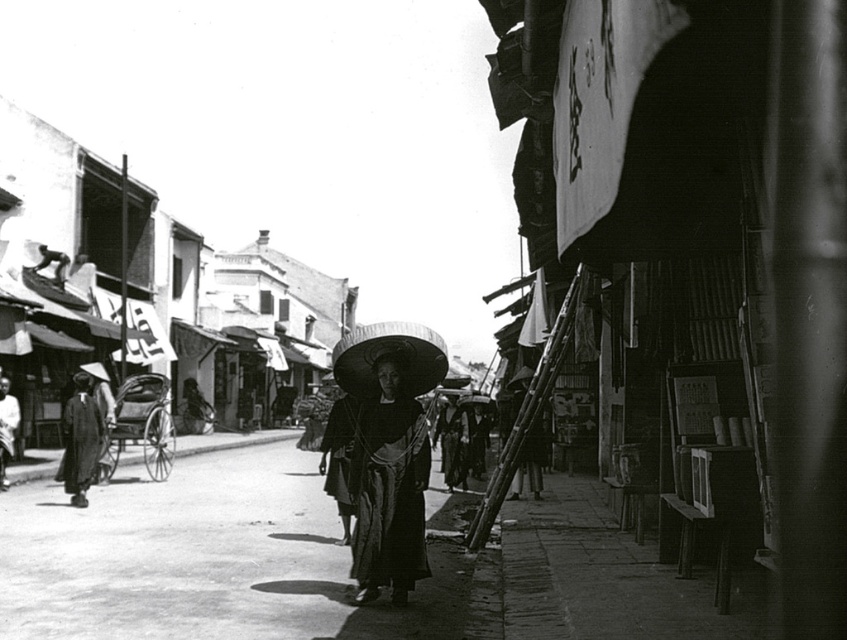
Based on the scene description, where is the matte black dress at center located in terms of coordinates?

The matte black dress at center is located at point coordinates of (388, 483).

You are a photographer trying to capture the woman in the dark fabric kimono at center without including the smooth concrete pavement at center in the frame. Based on their positions, is this possible?

The smooth concrete pavement at center is to the right of the dark fabric kimono at center, so if you position your camera to exclude the right side of the scene, you can capture the kimono without the pavement.

You are a photographer trying to capture both the matte black dress at center and the dark fabric kimono at center in a single shot. Given that your camera has a maximum focus range of 10 meters, will you be able to include both subjects in sharp focus?

The distance between the matte black dress at center and the dark fabric kimono at center is 10.27 meters. Since the camera can only focus up to 10 meters, the subjects are slightly out of the focus range. Therefore, both cannot be in sharp focus simultaneously.